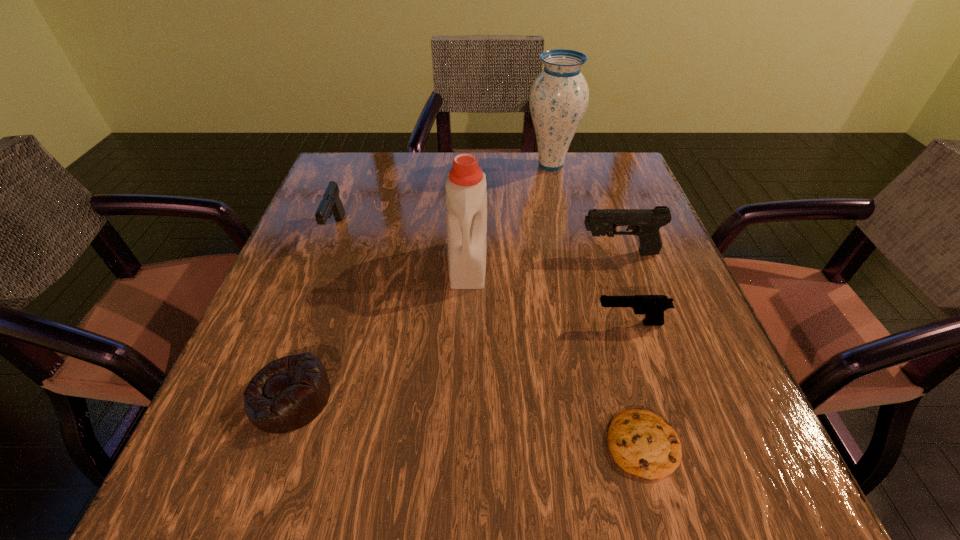
What are the coordinates of `object at the near right corner` in the screenshot? It's located at (642, 443).

You are a GUI agent. You are given a task and a screenshot of the screen. Output one action in this format:
    pyautogui.click(x=<x>, y=<y>)
    Task: Click on the vacant space at the far edge
    The image size is (960, 540).
    Given the screenshot: What is the action you would take?
    pyautogui.click(x=424, y=167)

You are a GUI agent. You are given a task and a screenshot of the screen. Output one action in this format:
    pyautogui.click(x=<x>, y=<y>)
    Task: Click on the free space at the near edge of the desktop
    This screenshot has height=540, width=960.
    Given the screenshot: What is the action you would take?
    pyautogui.click(x=572, y=483)

The image size is (960, 540). I want to click on vacant area at the left edge of the desktop, so click(x=350, y=258).

In order to click on vacant space at the right edge of the desktop in this screenshot , I will do `click(703, 424)`.

Where is `free space at the far left corner`? This screenshot has height=540, width=960. free space at the far left corner is located at coordinates (349, 185).

Where is `vacant space at the near left corner of the desktop`? vacant space at the near left corner of the desktop is located at coordinates (245, 459).

Find the location of `vacant space that is in between the shortest object and the vase`. vacant space that is in between the shortest object and the vase is located at coordinates (597, 304).

At what (x,y) coordinates should I click in order to perform the action: click on free spot between the third object from left to right and the leftmost pistol. Please return your answer as a coordinate pair (x, y). This screenshot has height=540, width=960. Looking at the image, I should click on (402, 247).

I want to click on unoccupied area between the farthest object and the fourth shortest object, so click(x=444, y=197).